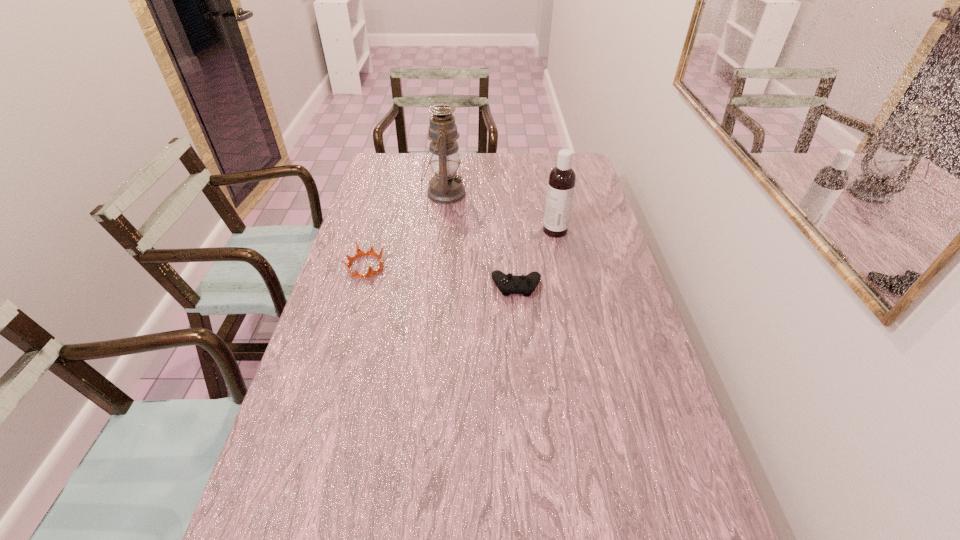
Where is `blank space located on the label side of the dishwasher detergent`? The image size is (960, 540). blank space located on the label side of the dishwasher detergent is located at coordinates (474, 231).

The width and height of the screenshot is (960, 540). Identify the location of free spot located on the label side of the dishwasher detergent. (428, 231).

The width and height of the screenshot is (960, 540). What are the coordinates of `free space located 0.220m on the right of the crown` in the screenshot? It's located at (454, 266).

Locate an element on the screen. vacant space positioned 0.230m on the front of the shortest object is located at coordinates (523, 364).

Image resolution: width=960 pixels, height=540 pixels. Find the location of `object that is positioned at the far edge`. object that is positioned at the far edge is located at coordinates (445, 187).

The image size is (960, 540). I want to click on object present at the left edge, so click(x=359, y=253).

Locate an element on the screen. The width and height of the screenshot is (960, 540). object present at the right edge is located at coordinates (561, 183).

Identify the location of vacant area at the far edge of the desktop. This screenshot has height=540, width=960. (524, 164).

In the image, there is a desktop. At what (x,y) coordinates should I click in order to perform the action: click on vacant space at the left edge. Please return your answer as a coordinate pair (x, y). This screenshot has width=960, height=540. Looking at the image, I should click on (332, 281).

At what (x,y) coordinates should I click in order to perform the action: click on free space at the right edge of the desktop. Please return your answer as a coordinate pair (x, y). The image size is (960, 540). Looking at the image, I should click on (579, 237).